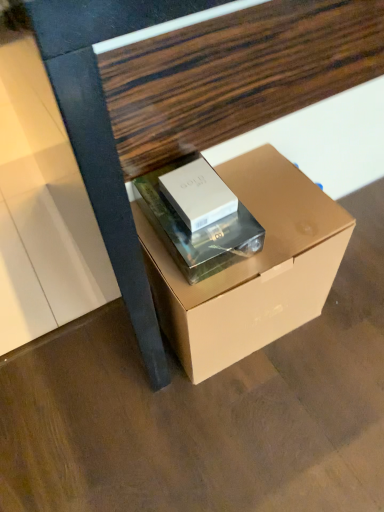
The image size is (384, 512). I want to click on free point to the right of matte white book at center, so click(x=285, y=215).